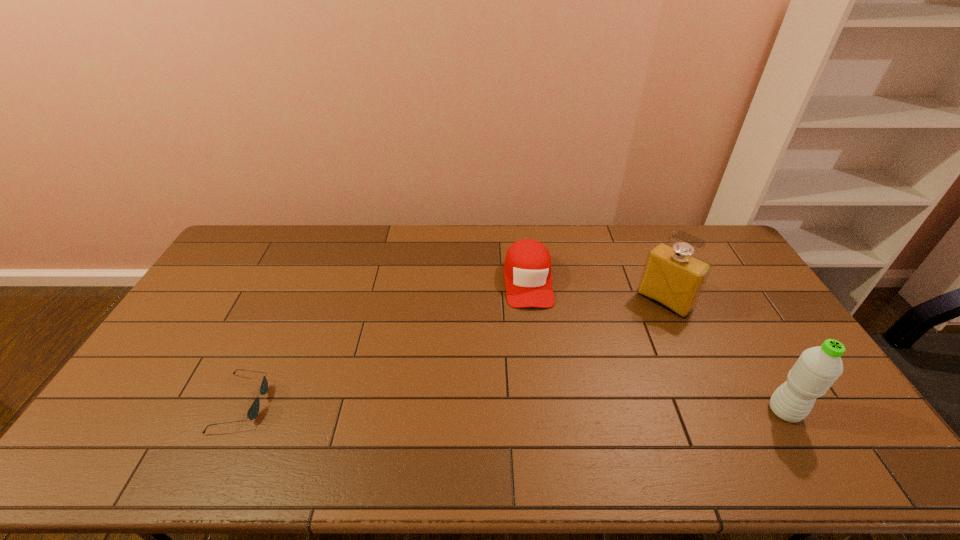
Image resolution: width=960 pixels, height=540 pixels. Find the location of `sunglasses`. sunglasses is located at coordinates (253, 411).

Identify the location of the leftmost object. The width and height of the screenshot is (960, 540). (253, 411).

The height and width of the screenshot is (540, 960). I want to click on water bottle, so click(x=816, y=370).

You are a GUI agent. You are given a task and a screenshot of the screen. Output one action in this format:
    pyautogui.click(x=<x>, y=<y>)
    Task: Click on the baseball cap
    
    Given the screenshot: What is the action you would take?
    pyautogui.click(x=527, y=271)

This screenshot has width=960, height=540. I want to click on the third object from right to left, so click(x=527, y=271).

Identify the location of perfume. This screenshot has height=540, width=960. pyautogui.click(x=673, y=278).

Where is `vacant area situated on the lenses of the leftmost object`? Image resolution: width=960 pixels, height=540 pixels. vacant area situated on the lenses of the leftmost object is located at coordinates (313, 403).

Find the location of `free spot located on the left of the rightmost object`. free spot located on the left of the rightmost object is located at coordinates (669, 411).

You are a GUI agent. You are given a task and a screenshot of the screen. Output one action in this format:
    pyautogui.click(x=<x>, y=<y>)
    Task: Click on the vacant space positioned 0.100m on the front-facing side of the baseball cap
    This screenshot has width=960, height=540.
    Given the screenshot: What is the action you would take?
    pyautogui.click(x=534, y=333)

Locate an element on the screen. vacant space located 0.390m on the front-facing side of the baseball cap is located at coordinates (543, 417).